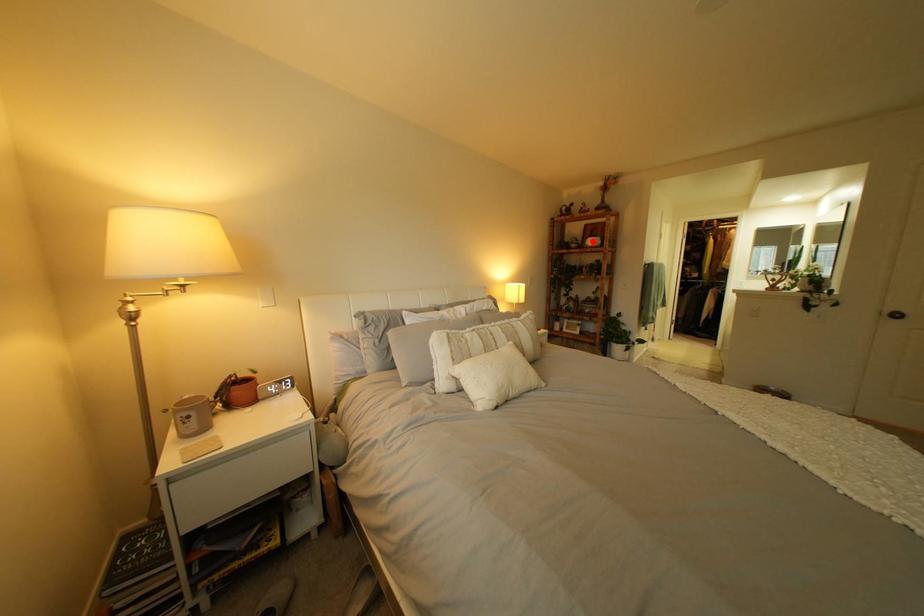
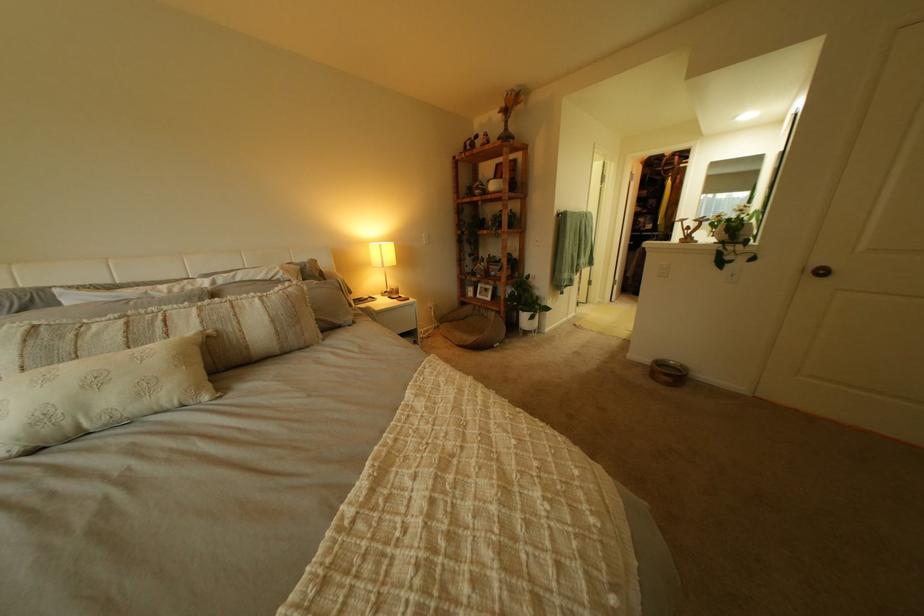
In the second image, find the point that corresponds to the highlighted location in the first image.

(497, 185)